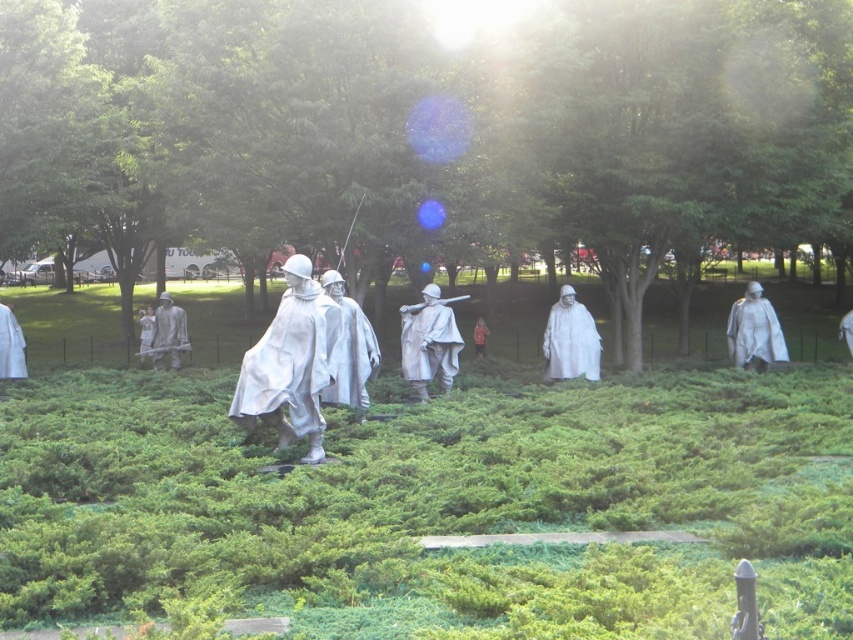
You are an art student analyzing the statues in the park. You notice the polished bronze statue at center and the matte white helmet at center. Which object appears larger in the scene?

The matte white helmet at center appears larger than the polished bronze statue at center.

You are a sculptor who wants to place a new statue in the park. The new statue must be shorter than the white glossy statue at center and positioned to the right of the matte silver helmet at center. Is this possible given the current arrangement?

The white glossy statue at center is much taller than the matte silver helmet at center, so the new statue can be placed to the right of the matte silver helmet at center as long as it is shorter than the white glossy statue at center.

You are a tour guide explaining the statues to visitors. You point to the polished bronze statue at center and the matte white helmet at center. Which one is closer to the visitors?

The polished bronze statue at center is closer to the visitors because it is in front of the matte white helmet at center.